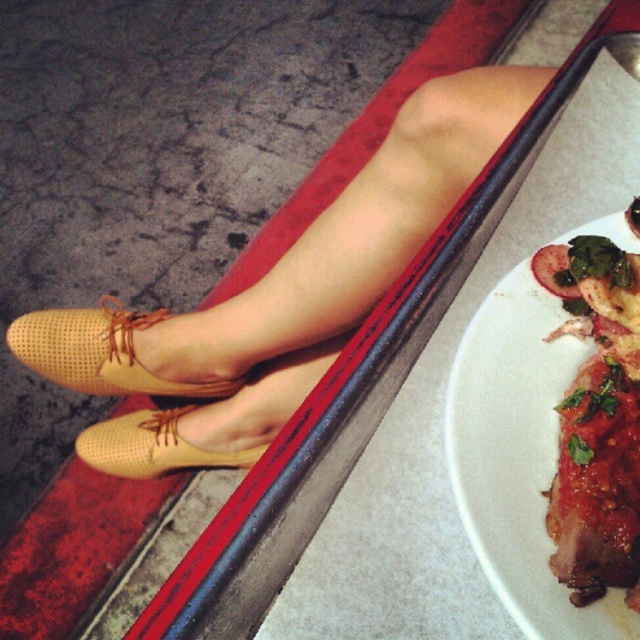
You are a shoe designer observing the image. You need to determine if the tan perforated shoes at center can fit into a storage box designed for the tan perforated shoe at lower left. The box is exactly the size of the smaller shoe. Can the larger shoe fit?

The tan perforated shoes at center is wider than the tan perforated shoe at lower left. Since the storage box is exactly the size of the smaller shoe, the larger shoe will not fit inside the box.

You are a waiter in a restaurant. You see the matte white plate at lower right and the tan perforated shoe at lower left. Which object is closer to the right edge of the table?

The matte white plate at lower right is closer to the right edge of the table because it is positioned to the right of the tan perforated shoe at lower left.

Looking at this image, you are a person sitting at a table and want to reach for a napkin located at point (612,627). There is an obstacle at point (49,374). Will you be able to reach the napkin without moving the obstacle?

Point (612,627) is in front of point (49,374), so the obstacle at point (49,374) is behind the napkin. Therefore, you can reach the napkin without moving the obstacle.